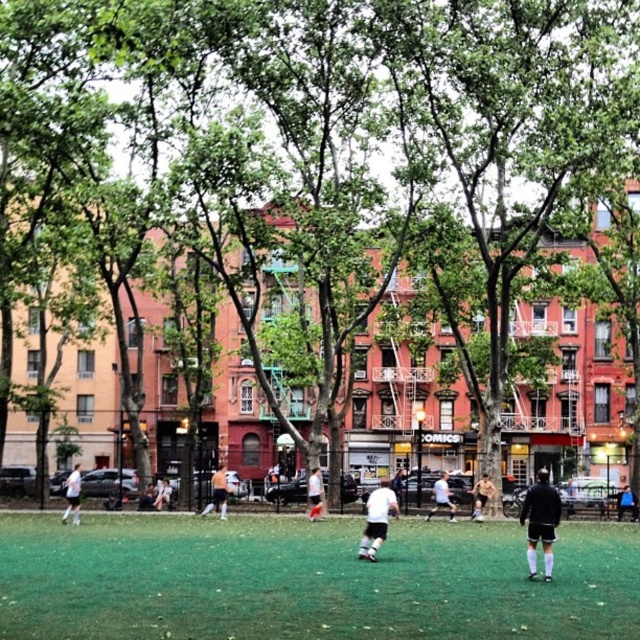
Question: Which of the following is the closest to the observer?

Choices:
 (A) (157, 504)
 (B) (580, 625)
 (C) (76, 472)

Answer: (B)

Question: Which object appears closest to the camera in this image?

Choices:
 (A) white jersey at center
 (B) white matte soccer player at left

Answer: (B)

Question: Is white jersey at center below white matte soccer player at left?

Choices:
 (A) yes
 (B) no

Answer: (B)

Question: Can you confirm if white jersey at center is positioned below white cotton shirt at center?

Choices:
 (A) no
 (B) yes

Answer: (A)

Question: Can you confirm if green artificial turf at center is bigger than white matte soccer player at left?

Choices:
 (A) no
 (B) yes

Answer: (B)

Question: Which object is farther from the camera taking this photo?

Choices:
 (A) white matte soccer player at center
 (B) green artificial turf at center
 (C) black matte shorts at center

Answer: (A)